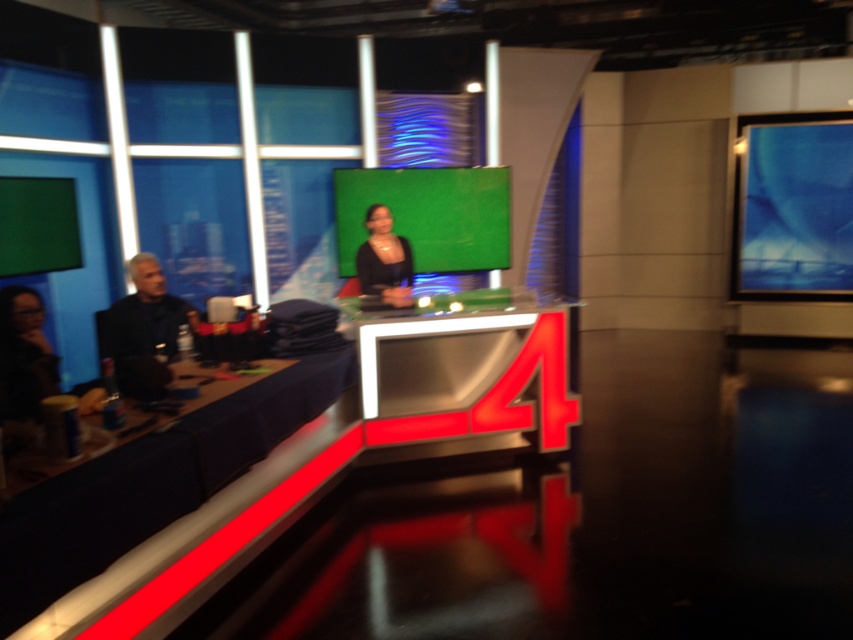
You are a camera operator in the studio. You need to focus on the black glossy dress at center, but there is a metallic table at left in the way. Can you adjust the camera angle to avoid the table and still capture the dress?

Yes, since the metallic table at left is closer to the viewer than the black glossy dress at center, adjusting the camera angle slightly upward or to the side would allow focusing on the dress while avoiding the table.

You are a guest speaker in the studio and need to move from your current position near the metallic table at left to the green matte screen at center for a live demonstration. Is the path between them clear of any obstacles?

The metallic table at left is positioned on the left side of green matte screen at center, so the path between them is clear of any obstacles.